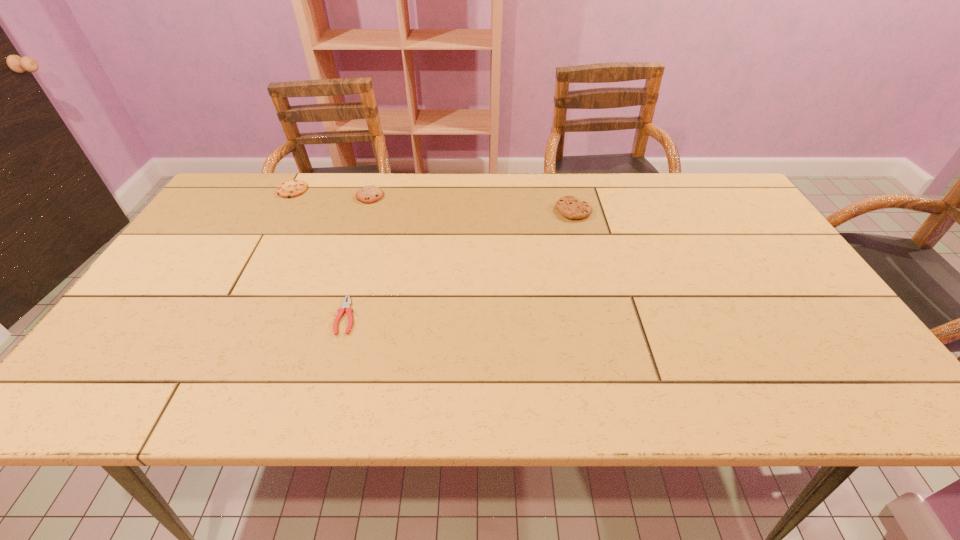
The image size is (960, 540). What are the coordinates of `vacant space in between the second cookie from left to right and the pliers` in the screenshot? It's located at (358, 256).

Where is `vacant area that lies between the second shortest cookie and the shortest object`? This screenshot has height=540, width=960. vacant area that lies between the second shortest cookie and the shortest object is located at coordinates (358, 256).

Identify the location of empty location between the tallest cookie and the pliers. (460, 264).

You are a GUI agent. You are given a task and a screenshot of the screen. Output one action in this format:
    pyautogui.click(x=<x>, y=<y>)
    Task: Click on the free space between the leftmost cookie and the second tallest object
    Image resolution: width=960 pixels, height=540 pixels.
    Given the screenshot: What is the action you would take?
    pyautogui.click(x=331, y=193)

Where is `vacant point located between the pliers and the second tallest cookie`? This screenshot has height=540, width=960. vacant point located between the pliers and the second tallest cookie is located at coordinates (358, 256).

Where is `free area in between the pliers and the second shortest object`? This screenshot has height=540, width=960. free area in between the pliers and the second shortest object is located at coordinates (320, 253).

I want to click on unoccupied position between the shortest object and the tallest cookie, so click(460, 264).

This screenshot has height=540, width=960. Find the location of `vacant area that lies between the shortest object and the second tallest cookie`. vacant area that lies between the shortest object and the second tallest cookie is located at coordinates (358, 256).

Identify which object is the second nearest to the second cookie from right to left. Please provide its 2D coordinates. Your answer should be formatted as a tuple, i.e. [(x, y)], where the tuple contains the x and y coordinates of a point satisfying the conditions above.

[(345, 305)]

At what (x,y) coordinates should I click in order to perform the action: click on object that stands as the second closest to the second shortest object. Please return your answer as a coordinate pair (x, y). The height and width of the screenshot is (540, 960). Looking at the image, I should click on (345, 305).